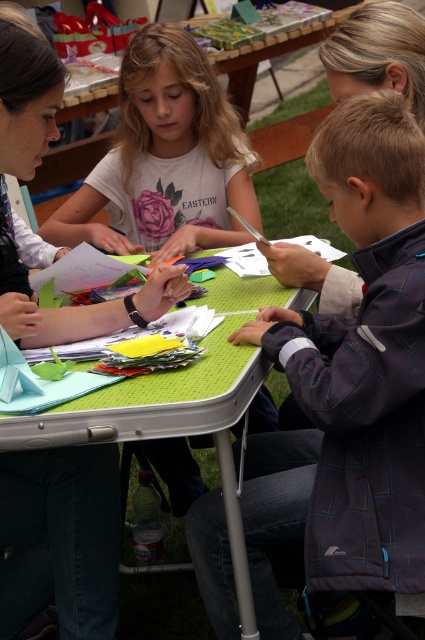
In the scene shown: Does dark blue textured jacket at lower right appear under matte white shirt at upper center?

Indeed, dark blue textured jacket at lower right is positioned under matte white shirt at upper center.

Which is in front, point (411, 314) or point (238, 225)?

Point (411, 314) is in front.

You are a GUI agent. You are given a task and a screenshot of the screen. Output one action in this format:
    pyautogui.click(x=<x>, y=<y>)
    Task: Click on the dark blue textured jacket at lower right
    The height and width of the screenshot is (640, 425).
    Given the screenshot: What is the action you would take?
    pyautogui.click(x=350, y=381)

Does point (391, 104) lie behind point (226, 326)?

No.

Is dark blue textured jacket at lower right positioned in front of green textured table at center?

That is False.

Where is `dark blue textured jacket at lower right`? dark blue textured jacket at lower right is located at coordinates (350, 381).

Does matte white shirt at upper center appear over green textured table at center?

Yes, matte white shirt at upper center is above green textured table at center.

Which is below, matte white shirt at upper center or green textured table at center?

green textured table at center is lower down.

Which is behind, point (115, 170) or point (220, 368)?

The point (115, 170) is more distant.

I want to click on matte white shirt at upper center, so click(166, 160).